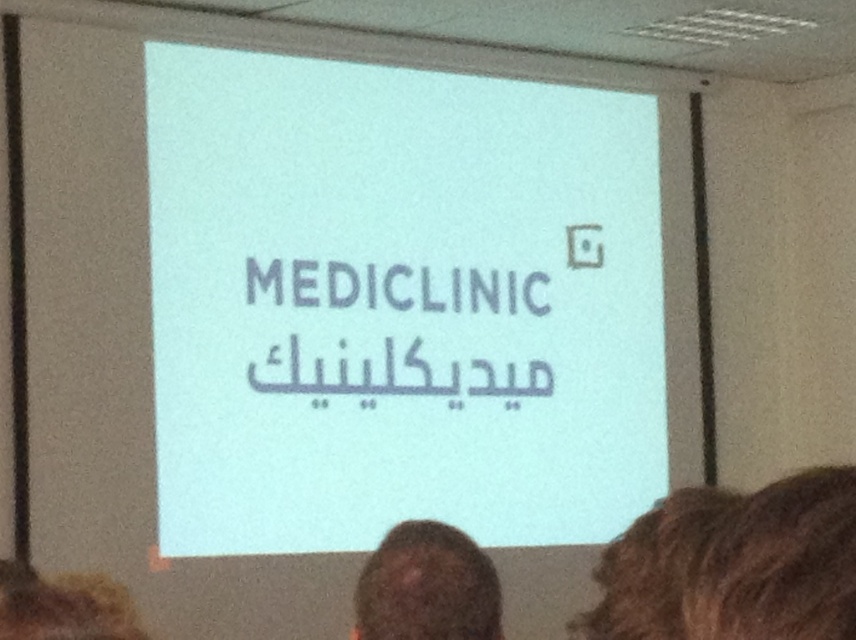
Is brown curly hair at lower right to the right of blonde hair at lower left from the viewer's perspective?

Correct, you'll find brown curly hair at lower right to the right of blonde hair at lower left.

Does point (789, 541) come closer to viewer compared to point (100, 616)?

Yes, it is.

What are the coordinates of `brown curly hair at lower right` in the screenshot? It's located at (734, 564).

What do you see at coordinates (428, 586) in the screenshot? I see `brown hair at lower center` at bounding box center [428, 586].

The height and width of the screenshot is (640, 856). I want to click on brown hair at lower center, so click(428, 586).

Is point (393, 227) farther from camera compared to point (391, 604)?

Yes, point (393, 227) is farther from viewer.

Does white matte projection screen at center lie in front of brown hair at lower center?

No, it is not.

Where is `white matte projection screen at center`? This screenshot has width=856, height=640. white matte projection screen at center is located at coordinates (397, 305).

Locate an element on the screen. white matte projection screen at center is located at coordinates (397, 305).